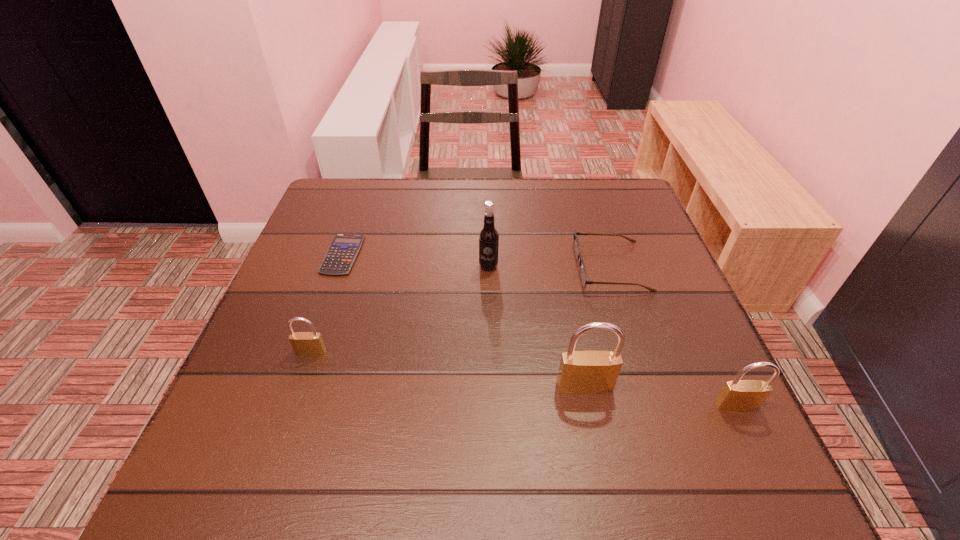
I want to click on free spot that satisfies the following two spatial constraints: 1. on the front-facing side of the second shortest object; 2. on the front-facing side of the fourth tallest object, so click(638, 352).